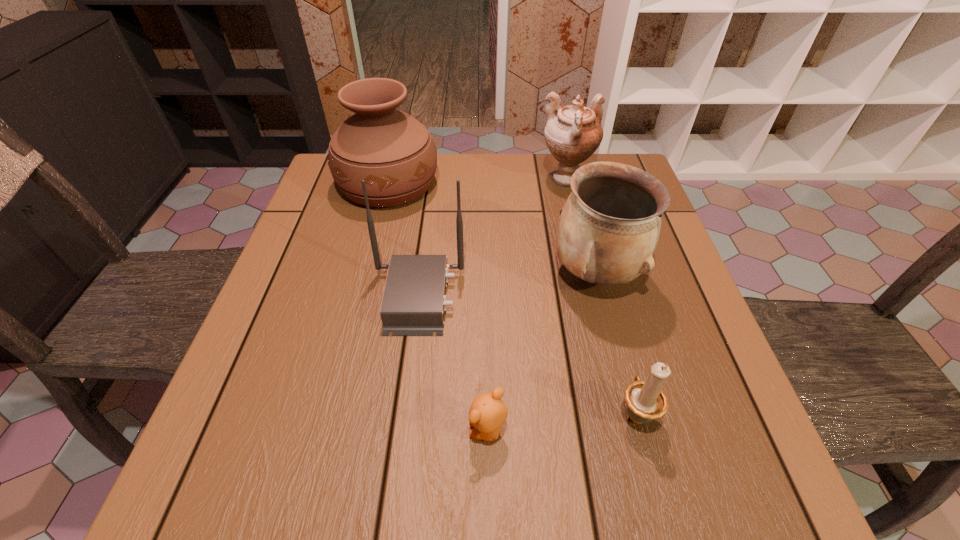
The height and width of the screenshot is (540, 960). In order to click on the leftmost urn in this screenshot , I will do `click(394, 153)`.

Find the location of a particular element. This screenshot has height=540, width=960. the nearest urn is located at coordinates (609, 227).

Where is `router`? router is located at coordinates (414, 302).

Locate an element on the screen. The image size is (960, 540). the fifth tallest object is located at coordinates click(646, 401).

The width and height of the screenshot is (960, 540). I want to click on the shortest object, so click(487, 413).

Find the location of a particular element. the third object from left to right is located at coordinates (487, 413).

The width and height of the screenshot is (960, 540). Identify the location of vacant region located on the right of the leftmost urn. (x=560, y=184).

Locate an element on the screen. The width and height of the screenshot is (960, 540). vacant area situated 0.130m on the front of the nearest urn is located at coordinates (618, 361).

You are a GUI agent. You are given a task and a screenshot of the screen. Output one action in this format:
    pyautogui.click(x=<x>, y=<y>)
    Task: Click on the vacant space positioned on the back of the router to connect cables
    Image resolution: width=960 pixels, height=540 pixels.
    Given the screenshot: What is the action you would take?
    pyautogui.click(x=516, y=297)

Locate an element on the screen. The width and height of the screenshot is (960, 540). vacant area located 0.190m on the handle side of the fifth tallest object is located at coordinates (608, 307).